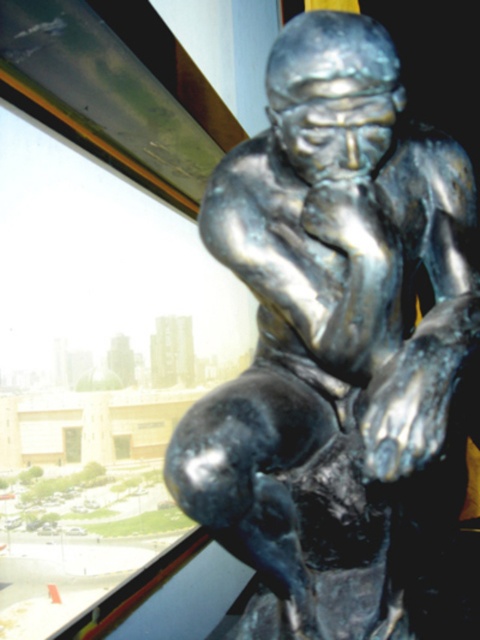
Does bronze statue at center come in front of transparent glass window at lower left?

That is True.

Is point (287, 497) in front of point (72, 433)?

Yes, point (287, 497) is in front of point (72, 433).

Does point (273, 324) lie in front of point (76, 452)?

Yes, it is.

Locate an element on the screen. The height and width of the screenshot is (640, 480). bronze statue at center is located at coordinates (337, 346).

Who is shorter, transparent glass window at lower left or transparent glass window at center?

transparent glass window at center is shorter.

Between transparent glass window at lower left and transparent glass window at center, which one appears on the left side from the viewer's perspective?

transparent glass window at lower left

What do you see at coordinates (72, 444) in the screenshot?
I see `transparent glass window at lower left` at bounding box center [72, 444].

At what (x,y) coordinates should I click in order to perform the action: click on transparent glass window at lower left. Please return your answer as a coordinate pair (x, y). Looking at the image, I should click on (72, 444).

Does bronze statue at center lie behind transparent glass window at center?

That is False.

Can you confirm if bronze statue at center is positioned above transparent glass window at center?

Yes.

Identify the location of bronze statue at center. (337, 346).

Locate an element on the screen. The width and height of the screenshot is (480, 640). bronze statue at center is located at coordinates (337, 346).